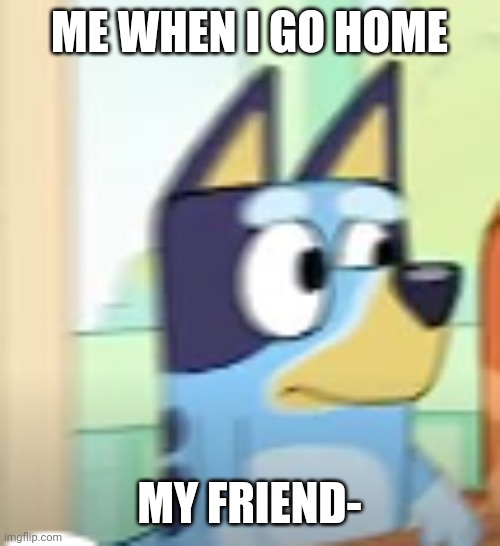
The height and width of the screenshot is (546, 500). What are the coordinates of `light blue chest` in the screenshot? It's located at pyautogui.click(x=332, y=453).